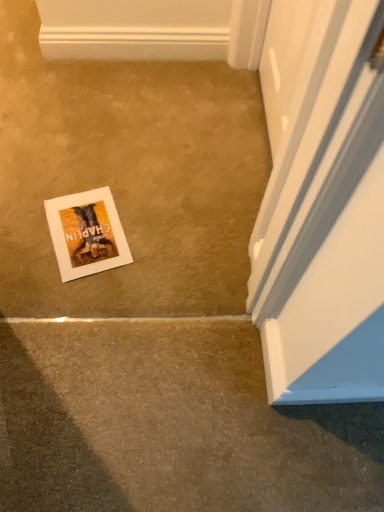
Describe the element at coordinates (86, 233) in the screenshot. I see `matte paper picture frame at center` at that location.

What are the coordinates of `matte paper picture frame at center` in the screenshot? It's located at (86, 233).

You are a GUI agent. You are given a task and a screenshot of the screen. Output one action in this format:
    pyautogui.click(x=<x>, y=<y>)
    Task: Click on the matte paper picture frame at center
    The image size is (384, 512).
    Given the screenshot: What is the action you would take?
    pyautogui.click(x=86, y=233)